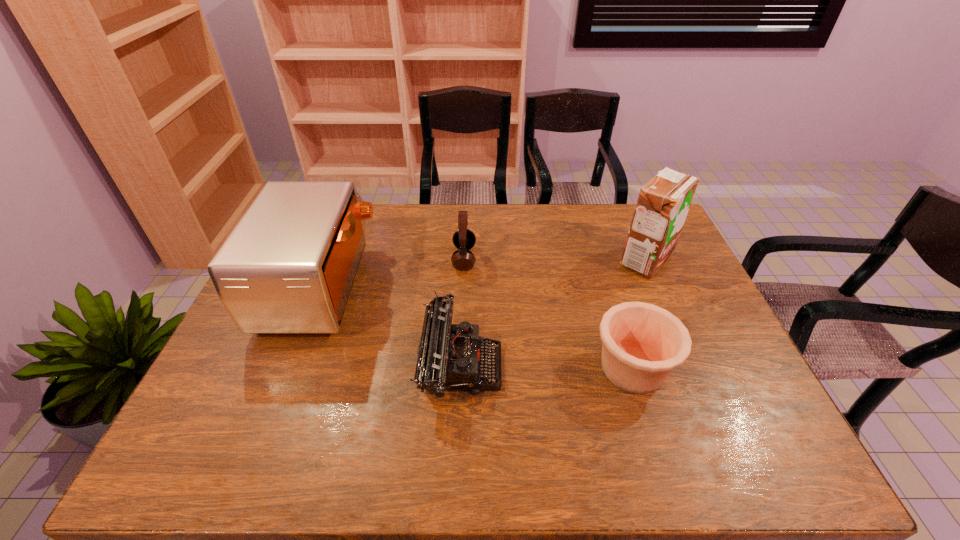
This screenshot has width=960, height=540. Identify the location of carton. (663, 203).

You are a GUI agent. You are given a task and a screenshot of the screen. Output one action in this format:
    pyautogui.click(x=<x>, y=<y>)
    Task: Click on the leftmost object
    This screenshot has height=540, width=960.
    Given the screenshot: What is the action you would take?
    pyautogui.click(x=289, y=265)

Find the location of a particular element. This screenshot has height=540, width=960. the third tallest object is located at coordinates (464, 239).

At what (x,y) coordinates should I click in order to perform the action: click on pottery. Please return your answer as a coordinate pair (x, y). The image size is (960, 540). Looking at the image, I should click on (642, 343).

The height and width of the screenshot is (540, 960). I want to click on typewriter, so click(450, 356).

Where is `vacant region located 0.060m on the straw side of the carton`? This screenshot has height=540, width=960. vacant region located 0.060m on the straw side of the carton is located at coordinates (599, 260).

The height and width of the screenshot is (540, 960). Find the location of `blank space located 0.170m on the straw side of the carton`. blank space located 0.170m on the straw side of the carton is located at coordinates (564, 260).

Identify the location of blank space located on the straw side of the carton. Image resolution: width=960 pixels, height=540 pixels. (589, 260).

The height and width of the screenshot is (540, 960). What are the coordinates of `free location located 0.400m on the door side of the toaster oven` in the screenshot? It's located at (500, 287).

Where is `free space located 0.140m on the ear pads of the third tallest object`? This screenshot has width=960, height=540. free space located 0.140m on the ear pads of the third tallest object is located at coordinates (518, 259).